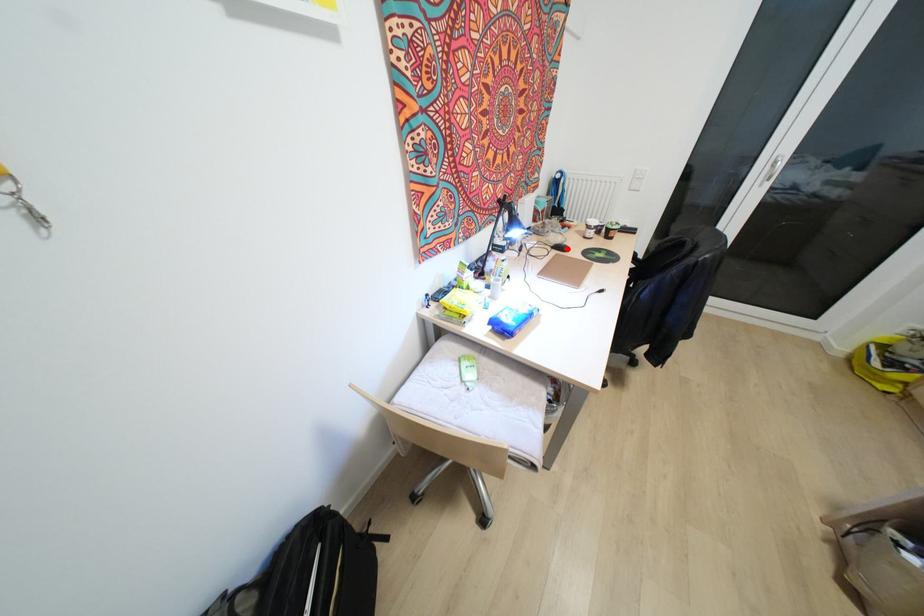
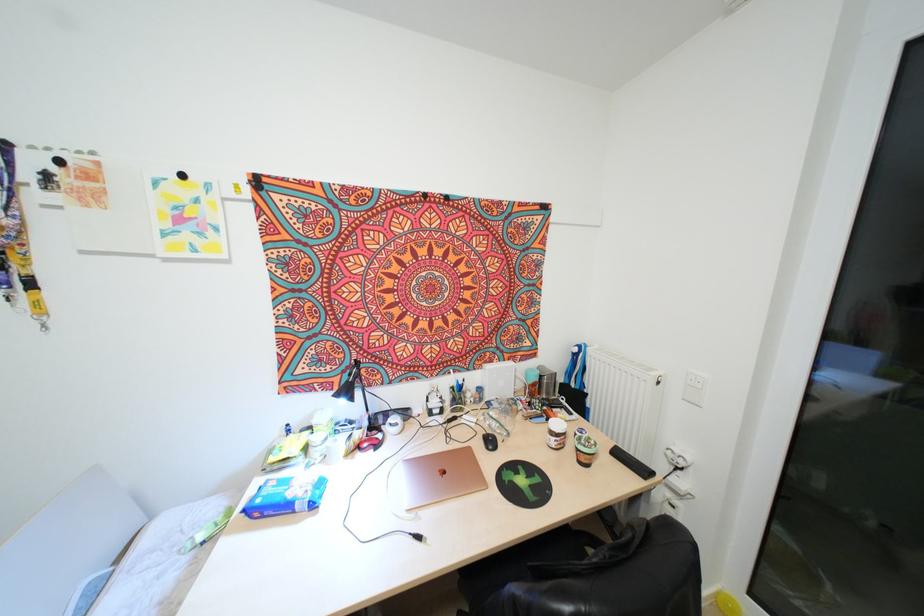
Locate, in the second image, the point that corresponds to the highlighted location in the first image.

(494, 448)